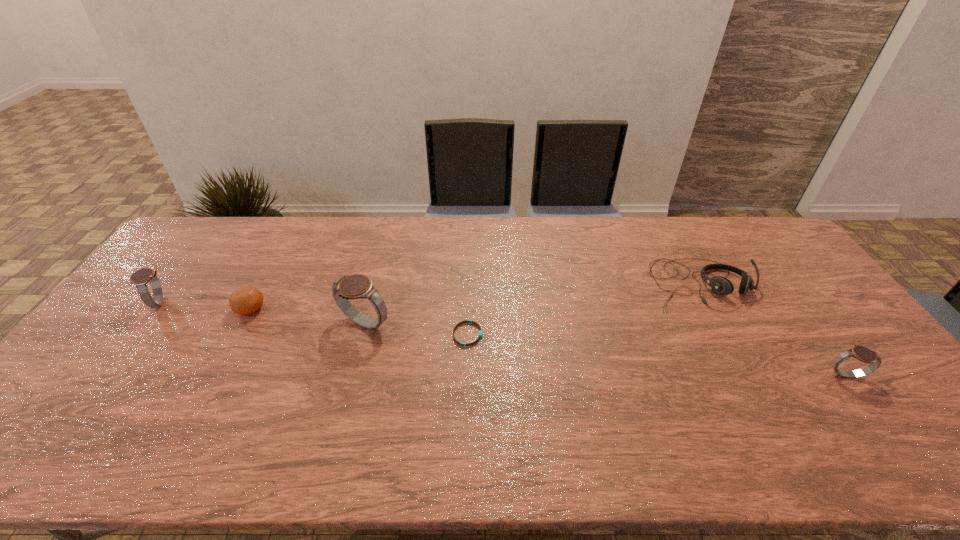
This screenshot has width=960, height=540. I want to click on object identified as the closest to the second object from left to right, so click(140, 278).

Select which object is the second closest to the second shortest watch. Please provide its 2D coordinates. Your answer should be formatted as a tuple, i.e. [(x, y)], where the tuple contains the x and y coordinates of a point satisfying the conditions above.

[(357, 286)]

The image size is (960, 540). Find the location of `watch that is the closest to the wristband`. watch that is the closest to the wristband is located at coordinates (357, 286).

Point out which watch is positioned as the second nearest to the rightmost watch. Please provide its 2D coordinates. Your answer should be formatted as a tuple, i.e. [(x, y)], where the tuple contains the x and y coordinates of a point satisfying the conditions above.

[(140, 278)]

You are a GUI agent. You are given a task and a screenshot of the screen. Output one action in this format:
    pyautogui.click(x=<x>, y=<y>)
    Task: Click on the free spot that satisfies the following two spatial constraints: 1. on the front side of the clementine; 2. on the left side of the leftmost object
    The image size is (960, 540).
    Given the screenshot: What is the action you would take?
    pyautogui.click(x=155, y=309)

Where is `free space in the image that satisfies the following two spatial constraints: 1. on the outer surface of the fifth object from left to right; 2. on the left side of the nearest object`? The image size is (960, 540). free space in the image that satisfies the following two spatial constraints: 1. on the outer surface of the fifth object from left to right; 2. on the left side of the nearest object is located at coordinates (748, 374).

This screenshot has height=540, width=960. What are the coordinates of `free space that satisfies the following two spatial constraints: 1. on the outer surface of the shortest watch; 2. on the right side of the headset` in the screenshot? It's located at (748, 374).

Locate an element on the screen. This screenshot has width=960, height=540. vacant position in the image that satisfies the following two spatial constraints: 1. on the back side of the nearest object; 2. on the buckle of the shortest object is located at coordinates (815, 334).